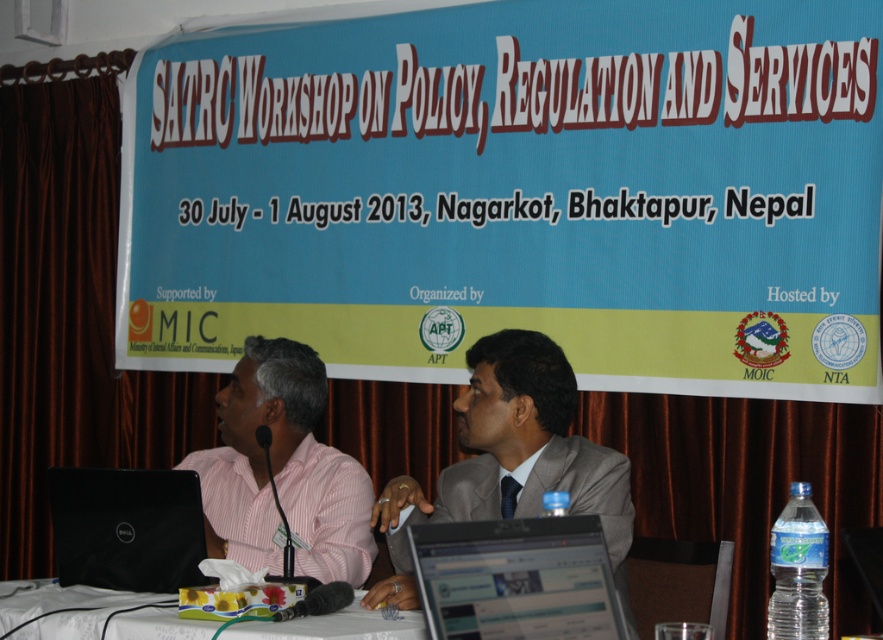
Question: Estimate the real-world distances between objects in this image. Which object is closer to the pink striped shirt at left?

Choices:
 (A) light brown suit at center
 (B) blue fabric banner at upper center

Answer: (A)

Question: Which point is farther from the camera taking this photo?

Choices:
 (A) (195, 461)
 (B) (34, 589)
 (C) (363, 232)
 (D) (457, 397)

Answer: (C)

Question: Which point appears closest to the camera in this image?

Choices:
 (A) (595, 566)
 (B) (276, 74)
 (C) (587, 458)

Answer: (A)

Question: From the image, what is the correct spatial relationship of pink striped shirt at left in relation to black matte laptop at left?

Choices:
 (A) right
 (B) left

Answer: (A)

Question: Observing the image, what is the correct spatial positioning of silver metallic laptop at center in reference to white fabric table at lower center?

Choices:
 (A) above
 (B) below

Answer: (A)

Question: Is pink striped shirt at left above black matte laptop at left?

Choices:
 (A) no
 (B) yes

Answer: (B)